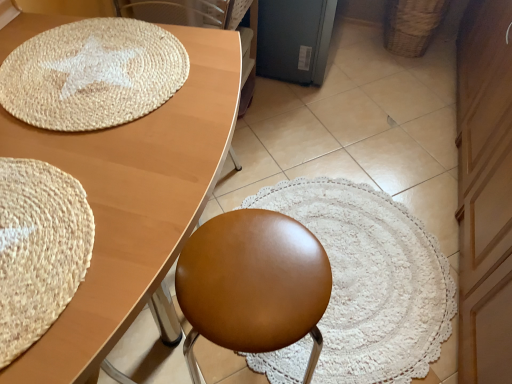
Where is `free space above natural fiber mat at upper left, the first mat when ordered from back to front (from a real-world perspective)`? free space above natural fiber mat at upper left, the first mat when ordered from back to front (from a real-world perspective) is located at coordinates (95, 68).